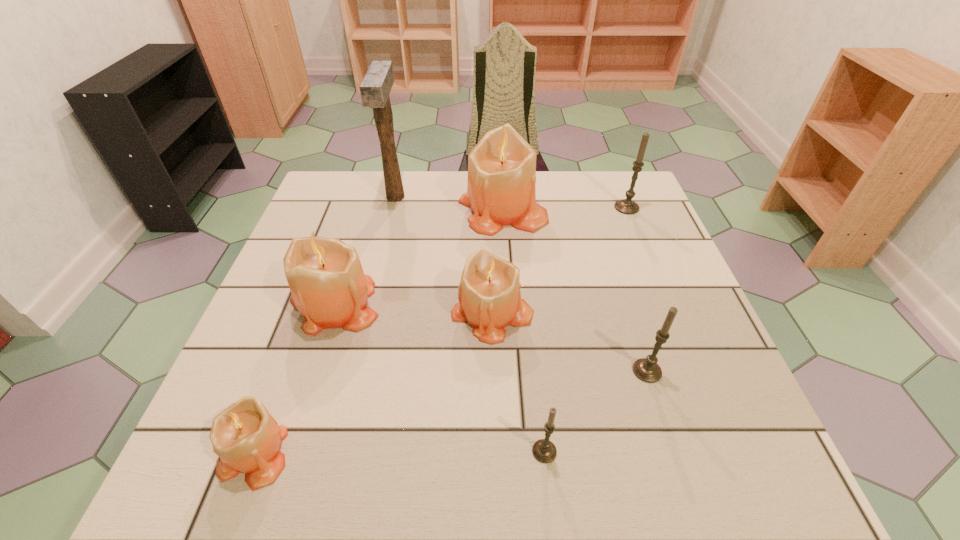
Locate which beige candle ranks third in proximity to the nearest gray candle. Please provide its 2D coordinates. Your answer should be formatted as a tuple, i.e. [(x, y)], where the tuple contains the x and y coordinates of a point satisfying the conditions above.

[(246, 437)]

Locate which gray candle is the second closest to the mallet. Please provide its 2D coordinates. Your answer should be formatted as a tuple, i.e. [(x, y)], where the tuple contains the x and y coordinates of a point satisfying the conditions above.

[(646, 369)]

Locate which gray candle ranks second in proximity to the second biggest beige candle. Please provide its 2D coordinates. Your answer should be formatted as a tuple, i.e. [(x, y)], where the tuple contains the x and y coordinates of a point satisfying the conditions above.

[(646, 369)]

I want to click on vacant area that satisfies the following two spatial constraints: 1. on the front side of the tallest object; 2. on the right side of the biggest beige candle, so click(393, 211).

Where is `free space that satisfies the following two spatial constraints: 1. on the front side of the smallest gray candle; 2. on the left side of the farthest beige candle`? free space that satisfies the following two spatial constraints: 1. on the front side of the smallest gray candle; 2. on the left side of the farthest beige candle is located at coordinates click(516, 451).

Locate an element on the screen. vacant region that satisfies the following two spatial constraints: 1. on the back side of the second biggest beige candle; 2. on the right side of the tallest object is located at coordinates pyautogui.click(x=370, y=197).

Locate an element on the screen. The width and height of the screenshot is (960, 540). vacant area that satisfies the following two spatial constraints: 1. on the back side of the seventh object from left to right; 2. on the left side of the leftmost gray candle is located at coordinates (536, 371).